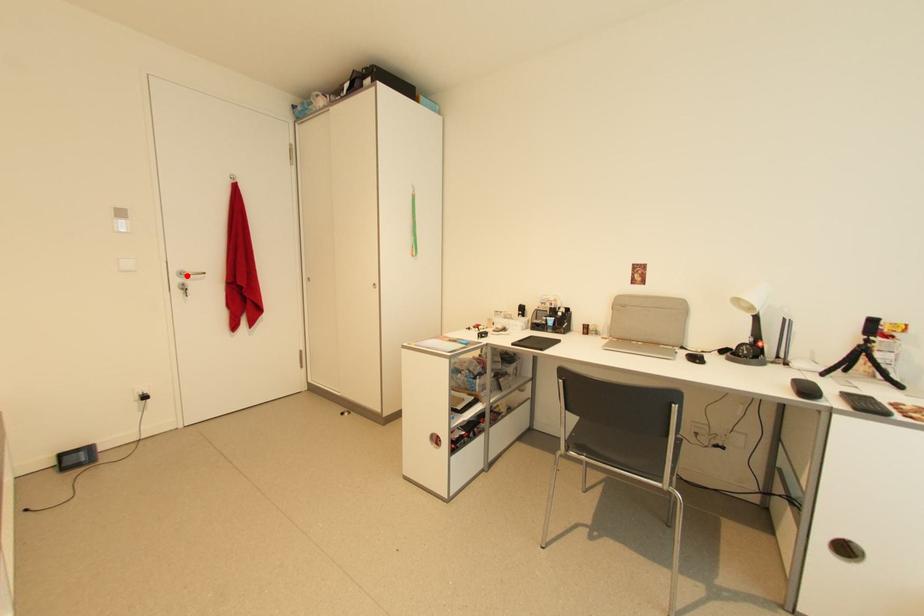
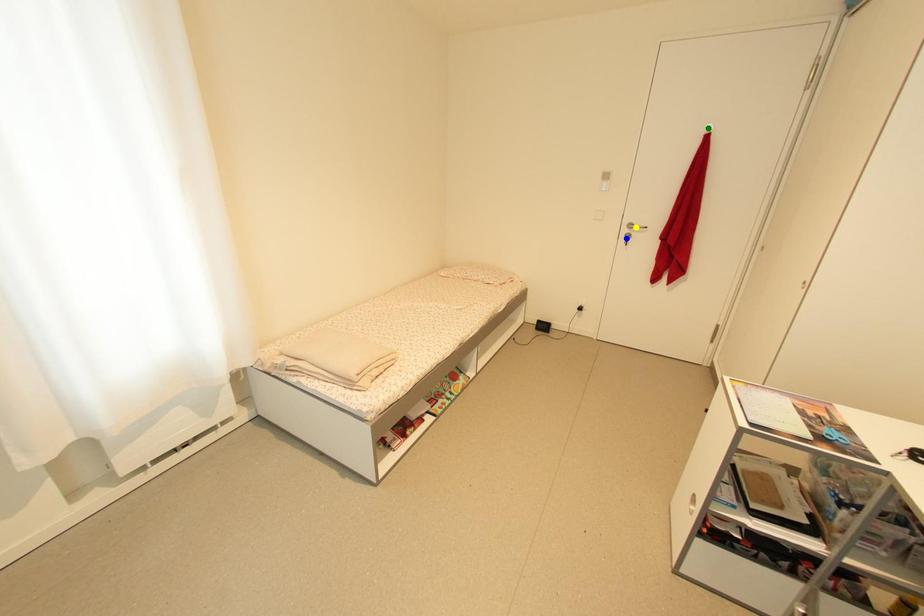
Question: I am providing you with two images of the same scene from different viewpoints. A red point is marked on the first image. You are given multiple points on the second image. In image 2, which mark is for the same physical point as the one in image 1?

Choices:
 (A) yellow point
 (B) blue point
 (C) green point

Answer: (A)